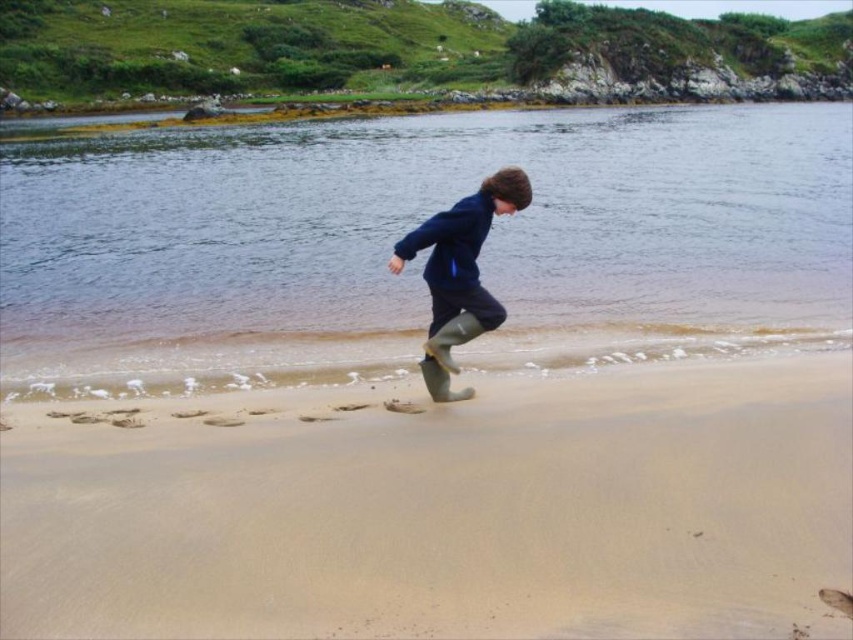
Which is in front, point (157, 202) or point (468, 266)?

Point (468, 266) is more forward.

Identify the location of clear water at center. Image resolution: width=853 pixels, height=640 pixels. (422, 252).

Who is shorter, smooth sand at lower center or rubber boots at center?

smooth sand at lower center

Does smooth sand at lower center have a greater width compared to rubber boots at center?

Indeed, smooth sand at lower center has a greater width compared to rubber boots at center.

Which is behind, point (68, 467) or point (432, 269)?

Positioned behind is point (432, 269).

You are a GUI agent. You are given a task and a screenshot of the screen. Output one action in this format:
    pyautogui.click(x=<x>, y=<y>)
    Task: Click on the smooth sand at lower center
    The image size is (853, 640).
    Given the screenshot: What is the action you would take?
    pyautogui.click(x=444, y=509)

Which of these two, smooth sand at lower center or clear water at center, stands taller?

clear water at center

Is smooth sand at lower center in front of clear water at center?

That is True.

What do you see at coordinates (444, 509) in the screenshot? The width and height of the screenshot is (853, 640). I see `smooth sand at lower center` at bounding box center [444, 509].

Identify the location of smooth sand at lower center. (444, 509).